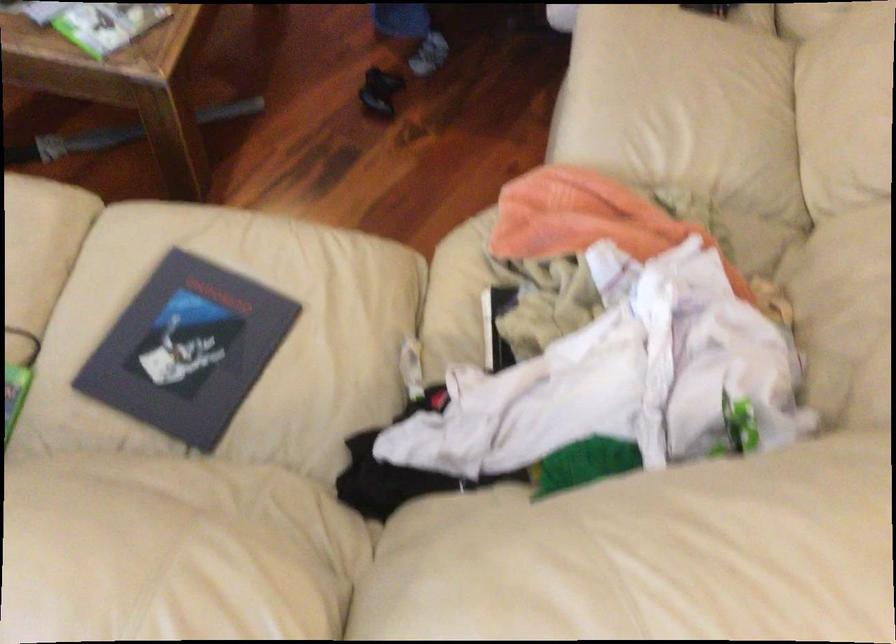
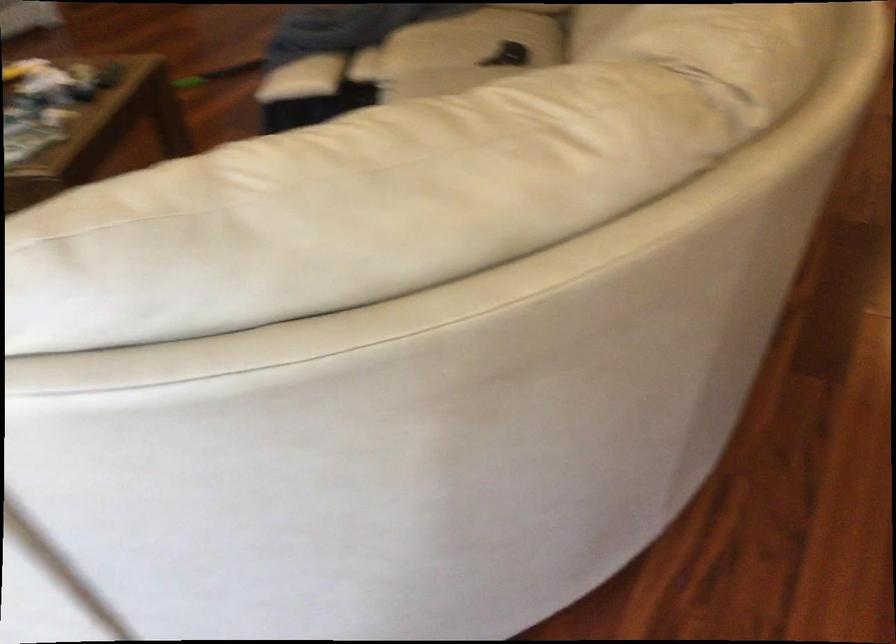
Question: The images are taken continuously from a first-person perspective. In which direction is your viewpoint rotating?

Choices:
 (A) Left
 (B) Right
 (C) Up
 (D) Down

Answer: (C)